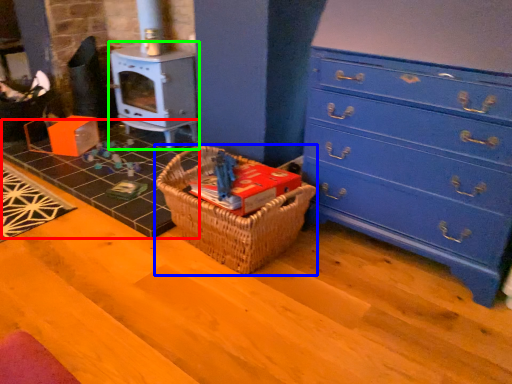
Question: Which object is the closest to the tile (highlighted by a red box)? Choose among these: picnic basket (highlighted by a blue box) or appliance (highlighted by a green box).

Choices:
 (A) picnic basket
 (B) appliance

Answer: (B)